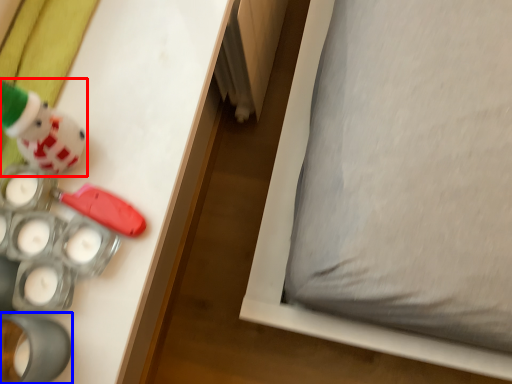
Question: Which object is further to the camera taking this photo, toy (highlighted by a red box) or toy (highlighted by a blue box)?

Choices:
 (A) toy
 (B) toy

Answer: (B)